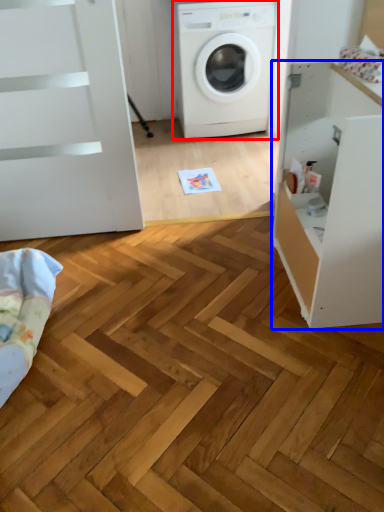
Question: Among these objects, which one is nearest to the camera, washing machine (highlighted by a red box) or file cabinet (highlighted by a blue box)?

Choices:
 (A) washing machine
 (B) file cabinet

Answer: (B)